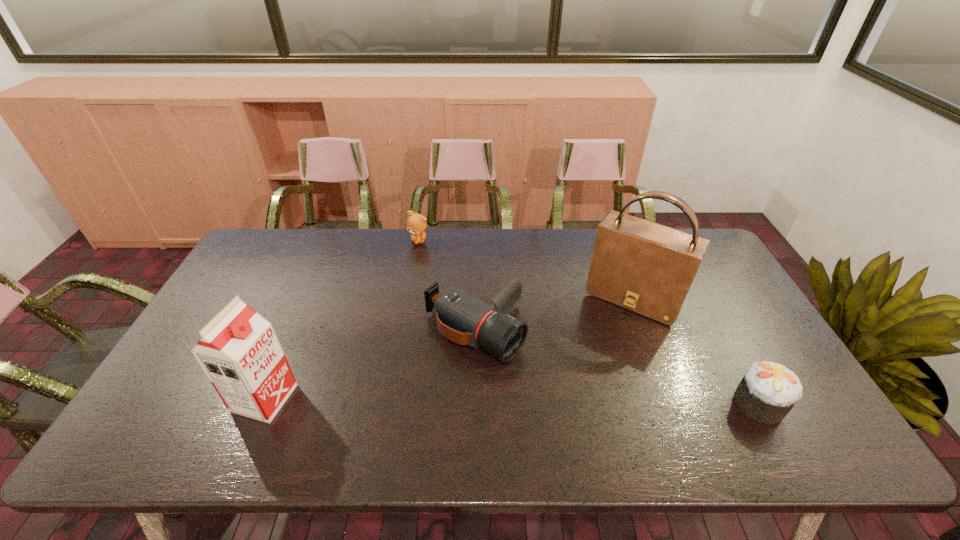
The height and width of the screenshot is (540, 960). I want to click on shoulder bag that is at the far edge, so click(648, 268).

The image size is (960, 540). Identify the location of soya milk situated at the near edge. (239, 352).

Where is `cupcake present at the near edge`? This screenshot has height=540, width=960. cupcake present at the near edge is located at coordinates (768, 391).

Locate an element on the screen. The image size is (960, 540). object that is at the right edge is located at coordinates (768, 391).

Identify the location of object positioned at the near right corner. (768, 391).

Image resolution: width=960 pixels, height=540 pixels. Find the location of `vacant position at the far edge of the desktop`. vacant position at the far edge of the desktop is located at coordinates (383, 268).

Where is `blank area at the near edge`? blank area at the near edge is located at coordinates (703, 404).

Where is `vacant space at the right edge of the desktop`? vacant space at the right edge of the desktop is located at coordinates (717, 341).

The height and width of the screenshot is (540, 960). I want to click on vacant space at the far left corner of the desktop, so click(x=253, y=269).

This screenshot has height=540, width=960. Identify the location of vacant region at the near left corner of the desktop. (166, 397).